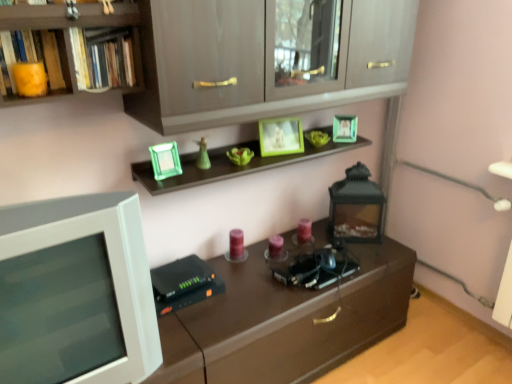
In order to face matte gray cabinet at upper center, should I rotate leftwards or rightwards?

Turn right approximately 3.040 degrees to face it.

In order to click on black matte lantern at center-right in this screenshot , I will do `click(356, 207)`.

Is hardcover books at upper left, which is the 1th book from right to left, further to camera compared to black matte lantern at center-right?

No, hardcover books at upper left, which is the 1th book from right to left, is closer to the camera.

Is hardcover books at upper left, which is the 1th book from right to left, at the left side of black matte lantern at center-right?

Yes.

Does hardcover books at upper left, which is the 1th book from right to left, have a greater width compared to black matte lantern at center-right?

In fact, hardcover books at upper left, which is the 1th book from right to left, might be narrower than black matte lantern at center-right.

Is the surface of black matte lantern at center-right in direct contact with white plastic computer monitor at left?

No.

You are a GUI agent. You are given a task and a screenshot of the screen. Output one action in this format:
    pyautogui.click(x=<x>, y=<y>)
    Task: Click on the appliance located behind the white plastic computer monitor at left
    
    Given the screenshot: What is the action you would take?
    pyautogui.click(x=356, y=207)

Can you confirm if black matte lantern at center-right is taller than white plastic computer monitor at left?

Incorrect, the height of black matte lantern at center-right is not larger of that of white plastic computer monitor at left.

Considering the sizes of black matte lantern at center-right and hardcover books at upper left, which is the 1th book from right to left, in the image, is black matte lantern at center-right bigger or smaller than hardcover books at upper left, which is the 1th book from right to left,?

Considering their sizes, black matte lantern at center-right takes up more space than hardcover books at upper left, which is the 1th book from right to left.

The height and width of the screenshot is (384, 512). Find the location of `appliance behind the hardcover books at upper left, placed as the second book when sorted from left to right`. appliance behind the hardcover books at upper left, placed as the second book when sorted from left to right is located at coordinates (356, 207).

Considering the points (332, 238) and (90, 77), which point is in front, point (332, 238) or point (90, 77)?

The point (90, 77) is in front.

From a real-world perspective, is black matte lantern at center-right over hardcover books at upper left, placed as the second book when sorted from left to right?

No, from a real-world perspective, black matte lantern at center-right is not on top of hardcover books at upper left, placed as the second book when sorted from left to right.

Considering the sizes of objects white plastic computer monitor at left and matte gray cabinet at upper center in the image provided, who is shorter, white plastic computer monitor at left or matte gray cabinet at upper center?

matte gray cabinet at upper center is shorter.

Where is `cabinetry positioned vertically above the white plastic computer monitor at left (from a real-world perspective)`? cabinetry positioned vertically above the white plastic computer monitor at left (from a real-world perspective) is located at coordinates (266, 58).

Looking at this image, which is correct: white plastic computer monitor at left is inside matte gray cabinet at upper center, or outside of it?

The correct answer is: outside.

From a real-world perspective, is white plastic computer monitor at left located beneath matte gray cabinet at upper center?

Yes, from a real-world perspective, white plastic computer monitor at left is below matte gray cabinet at upper center.

Considering the sizes of objects matte gray cabinet at upper center and white plastic computer monitor at left in the image provided, who is shorter, matte gray cabinet at upper center or white plastic computer monitor at left?

With less height is matte gray cabinet at upper center.

From the image's perspective, which object appears higher, matte gray cabinet at upper center or white plastic computer monitor at left?

From the image's view, matte gray cabinet at upper center is above.

Which is closer, [296,88] or [54,292]?

Clearly, point [296,88] is more distant from the camera than point [54,292].

Consider the image. In the image, is hardcover books at upper left, placed as the second book when sorted from left to right, on the left side or the right side of matte yellow book at upper left, placed as the 1th book when sorted from left to right?

hardcover books at upper left, placed as the second book when sorted from left to right, is to the right of matte yellow book at upper left, placed as the 1th book when sorted from left to right.

From the image's perspective, is hardcover books at upper left, which is the 1th book from right to left, above or below matte yellow book at upper left, placed as the 1th book when sorted from left to right?

hardcover books at upper left, which is the 1th book from right to left, is situated higher than matte yellow book at upper left, placed as the 1th book when sorted from left to right, in the image.

Is hardcover books at upper left, placed as the second book when sorted from left to right, taller or shorter than matte yellow book at upper left, the second book viewed from the right?

Clearly, hardcover books at upper left, placed as the second book when sorted from left to right, is taller compared to matte yellow book at upper left, the second book viewed from the right.

Is hardcover books at upper left, which is the 1th book from right to left, aimed at matte yellow book at upper left, the second book viewed from the right?

No.

Is black matte lantern at center-right looking in the opposite direction of matte yellow book at upper left, the second book viewed from the right?

That's not correct — black matte lantern at center-right is not looking away from matte yellow book at upper left, the second book viewed from the right.

Considering the relative sizes of black matte lantern at center-right and matte yellow book at upper left, placed as the 1th book when sorted from left to right, in the image provided, is black matte lantern at center-right taller than matte yellow book at upper left, placed as the 1th book when sorted from left to right,?

Correct, black matte lantern at center-right is much taller as matte yellow book at upper left, placed as the 1th book when sorted from left to right.

From a real-world perspective, count 1st books upward from the black matte lantern at center-right and point to it. Please provide its 2D coordinates.

[(34, 58)]

This screenshot has height=384, width=512. What are the coordinates of `appliance behind the hardcover books at upper left, placed as the second book when sorted from left to right` in the screenshot? It's located at (356, 207).

Identify the location of computer monitor below the black matte lantern at center-right (from the image's perspective). (86, 287).

Which object lies further to the anchor point matte yellow book at upper left, placed as the 1th book when sorted from left to right, white plastic computer monitor at left or black matte lantern at center-right?

The object further to matte yellow book at upper left, placed as the 1th book when sorted from left to right, is black matte lantern at center-right.

Based on the photo, which object lies nearer to the anchor point hardcover books at upper left, placed as the second book when sorted from left to right, white plastic computer monitor at left or matte yellow book at upper left, the second book viewed from the right?

matte yellow book at upper left, the second book viewed from the right, lies closer to hardcover books at upper left, placed as the second book when sorted from left to right, than the other object.

When comparing their distances from hardcover books at upper left, placed as the second book when sorted from left to right, does matte yellow book at upper left, placed as the 1th book when sorted from left to right, or matte gray cabinet at upper center seem closer?

Among the two, matte yellow book at upper left, placed as the 1th book when sorted from left to right, is located nearer to hardcover books at upper left, placed as the second book when sorted from left to right.

Estimate the real-world distances between objects in this image. Which object is closer to matte gray cabinet at upper center, white plastic computer monitor at left or black matte lantern at center-right?

white plastic computer monitor at left lies closer to matte gray cabinet at upper center than the other object.

Based on their spatial positions, is matte gray cabinet at upper center or black matte lantern at center-right closer to hardcover books at upper left, placed as the second book when sorted from left to right?

matte gray cabinet at upper center is closer to hardcover books at upper left, placed as the second book when sorted from left to right.

Considering their positions, is matte gray cabinet at upper center positioned closer to black matte lantern at center-right than white plastic computer monitor at left?

matte gray cabinet at upper center lies closer to black matte lantern at center-right than the other object.

Consider the image. Looking at the image, which one is located closer to hardcover books at upper left, which is the 1th book from right to left, black matte lantern at center-right or matte gray cabinet at upper center?

Among the two, matte gray cabinet at upper center is located nearer to hardcover books at upper left, which is the 1th book from right to left.

Considering their positions, is hardcover books at upper left, which is the 1th book from right to left, positioned closer to black matte lantern at center-right than white plastic computer monitor at left?

white plastic computer monitor at left lies closer to black matte lantern at center-right than the other object.

This screenshot has height=384, width=512. What are the coordinates of `book between matte yellow book at upper left, placed as the 1th book when sorted from left to right, and black matte lantern at center-right` in the screenshot? It's located at (105, 57).

At what (x,y) coordinates should I click in order to perform the action: click on cabinetry located between white plastic computer monitor at left and black matte lantern at center-right in the left-right direction. Please return your answer as a coordinate pair (x, y). This screenshot has height=384, width=512. Looking at the image, I should click on point(266,58).

I want to click on cabinetry located between hardcover books at upper left, placed as the second book when sorted from left to right, and black matte lantern at center-right in the left-right direction, so click(x=266, y=58).

Find the location of a particular element. book between hardcover books at upper left, placed as the second book when sorted from left to right, and white plastic computer monitor at left vertically is located at coordinates (34, 58).